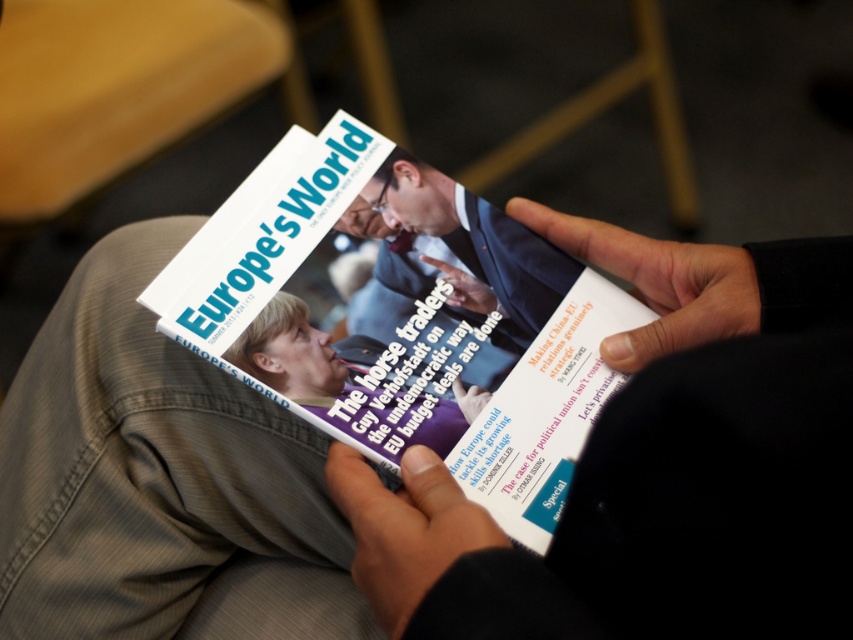
Which is below, black leather hand at center or matte black hand at upper center?

black leather hand at center is lower down.

Is black leather hand at center smaller than matte black hand at upper center?

No.

Does point (474, 300) lie behind point (373, 225)?

No, it is not.

Where is `black leather hand at center`? Image resolution: width=853 pixels, height=640 pixels. black leather hand at center is located at coordinates (463, 288).

Consider the image. Does smooth black hand at center come in front of matte black hand at center?

That is True.

Between point (573, 252) and point (463, 388), which one is positioned behind?

Point (573, 252)

Where is `smooth black hand at center`? The height and width of the screenshot is (640, 853). smooth black hand at center is located at coordinates (659, 284).

Is matte black hand at upper center closer to the viewer compared to matte black hand at center?

No, matte black hand at upper center is behind matte black hand at center.

Who is higher up, matte black hand at upper center or matte black hand at center?

matte black hand at upper center is above.

Between point (366, 236) and point (483, 394), which one is positioned behind?

The point (366, 236) is more distant.

You are a GUI agent. You are given a task and a screenshot of the screen. Output one action in this format:
    pyautogui.click(x=<x>, y=<y>)
    Task: Click on the matte black hand at upper center
    
    Given the screenshot: What is the action you would take?
    pyautogui.click(x=363, y=220)